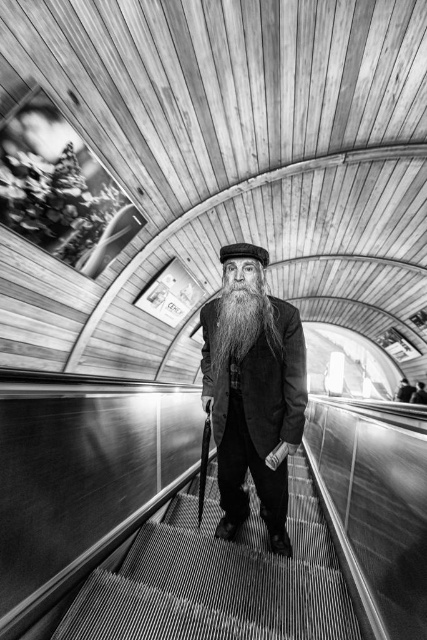
You are standing at the center of the subway station and see a point marked at coordinates (242, 321). Which object in the scene does this point correspond to?

The point at coordinates (242, 321) corresponds to the long white beard at center.

You are an artist trying to sketch the man in the subway station. You notice the smooth black coat at center and the long white beard at center. Which of these two features has a greater width?

The smooth black coat at center has a greater width than the long white beard at center.

You are a photographer analyzing this black and white photo. You notice the long white beard at center and the black felt hat at center. Which object takes up more space in the image?

The long white beard at center is larger in size than the black felt hat at center, so it takes up more space in the image.